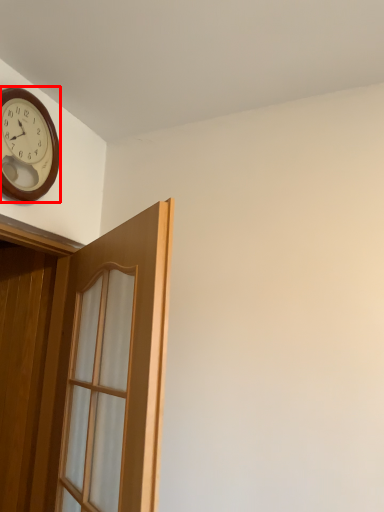
Question: From the image's perspective, where is clock (annotated by the red box) located relative to door?

Choices:
 (A) above
 (B) below

Answer: (A)